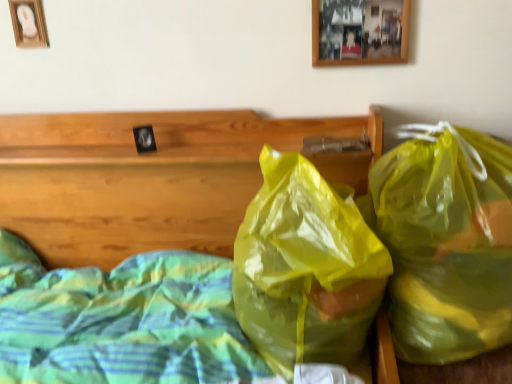
Identify the location of wooden picture frame at upper left, which is counted as the 2th picture frame, starting from the front. (28, 23).

The width and height of the screenshot is (512, 384). Describe the element at coordinates (360, 32) in the screenshot. I see `wooden picture frame at upper center, acting as the 2th picture frame starting from the back` at that location.

Measure the distance between point (487,321) and camera.

Point (487,321) and camera are 34.45 inches apart from each other.

The width and height of the screenshot is (512, 384). Find the location of `wooden picture frame at upper left, which is counted as the 2th picture frame, starting from the front`. wooden picture frame at upper left, which is counted as the 2th picture frame, starting from the front is located at coordinates (28, 23).

Is translucent yellow plastic bag at right, the second plastic bag viewed from the left, bigger than translucent plastic bags at center?

Actually, translucent yellow plastic bag at right, the second plastic bag viewed from the left, might be smaller than translucent plastic bags at center.

Is the depth of translucent yellow plastic bag at right, which is counted as the 1th plastic bag, starting from the right, less than that of translucent plastic bags at center?

No, it is behind translucent plastic bags at center.

From a real-world perspective, is translucent yellow plastic bag at right, which is counted as the 1th plastic bag, starting from the right, positioned above or below translucent plastic bags at center?

Clearly, from a real-world perspective, translucent yellow plastic bag at right, which is counted as the 1th plastic bag, starting from the right, is below translucent plastic bags at center.

Does point (454, 329) come behind point (210, 245)?

No, it is in front of (210, 245).

From a real-world perspective, is translucent plastic bags at center positioned over wooden picture frame at upper left, acting as the 1th picture frame starting from the left, based on gravity?

Incorrect, from a real-world perspective, translucent plastic bags at center is lower than wooden picture frame at upper left, acting as the 1th picture frame starting from the left.

In the scene shown: From the image's perspective, is translucent plastic bags at center below wooden picture frame at upper left, acting as the 1th picture frame starting from the left?

Indeed, from the image's perspective, translucent plastic bags at center is shown beneath wooden picture frame at upper left, acting as the 1th picture frame starting from the left.

Considering the positions of points (213, 187) and (19, 0), is point (213, 187) farther from camera compared to point (19, 0)?

Yes, it is behind point (19, 0).

Measure the distance from translucent plastic bags at center to wooden picture frame at upper left, acting as the 1th picture frame starting from the left.

The distance of translucent plastic bags at center from wooden picture frame at upper left, acting as the 1th picture frame starting from the left, is 20.96 inches.

From the image's perspective, who appears lower, wooden picture frame at upper center, the second picture frame positioned from the left, or translucent plastic bags at center?

translucent plastic bags at center, from the image's perspective.

From the picture: Is wooden picture frame at upper center, the second picture frame positioned from the left, oriented away from translucent plastic bags at center?

wooden picture frame at upper center, the second picture frame positioned from the left, is not turned away from translucent plastic bags at center.

Which is farther from the camera, (386,62) or (257,148)?

Positioned behind is point (257,148).

Visually, is wooden picture frame at upper center, the 1th picture frame positioned from the front, positioned to the left or to the right of translucent plastic bags at center?

wooden picture frame at upper center, the 1th picture frame positioned from the front, is positioned on translucent plastic bags at center's right side.

Considering the sizes of objects translucent yellow plastic bag at center, which is counted as the second plastic bag, starting from the right, and wooden picture frame at upper center, acting as the 2th picture frame starting from the back, in the image provided, who is smaller, translucent yellow plastic bag at center, which is counted as the second plastic bag, starting from the right, or wooden picture frame at upper center, acting as the 2th picture frame starting from the back,?

wooden picture frame at upper center, acting as the 2th picture frame starting from the back, is smaller.

Consider the image. From the image's perspective, is translucent yellow plastic bag at center, which is counted as the second plastic bag, starting from the right, over wooden picture frame at upper center, acting as the 2th picture frame starting from the back?

No, from the image's perspective, translucent yellow plastic bag at center, which is counted as the second plastic bag, starting from the right, is not on top of wooden picture frame at upper center, acting as the 2th picture frame starting from the back.

Which object is more forward, translucent yellow plastic bag at center, marked as the 1th plastic bag in a left-to-right arrangement, or wooden picture frame at upper center, acting as the 2th picture frame starting from the back?

Positioned in front is translucent yellow plastic bag at center, marked as the 1th plastic bag in a left-to-right arrangement.

Looking at this image, how distant is translucent yellow plastic bag at center, marked as the 1th plastic bag in a left-to-right arrangement, from wooden picture frame at upper center, the 1th picture frame positioned from the front?

A distance of 22.49 inches exists between translucent yellow plastic bag at center, marked as the 1th plastic bag in a left-to-right arrangement, and wooden picture frame at upper center, the 1th picture frame positioned from the front.

Consider the image. Is translucent plastic bags at center aimed at translucent yellow plastic bag at right, which is counted as the 1th plastic bag, starting from the right?

No, translucent plastic bags at center is not aimed at translucent yellow plastic bag at right, which is counted as the 1th plastic bag, starting from the right.

Considering the relative sizes of translucent plastic bags at center and translucent yellow plastic bag at right, which is counted as the 1th plastic bag, starting from the right, in the image provided, is translucent plastic bags at center smaller than translucent yellow plastic bag at right, which is counted as the 1th plastic bag, starting from the right,?

No.

How different are the orientations of translucent plastic bags at center and translucent yellow plastic bag at right, the second plastic bag viewed from the left, in degrees?

0.857 degrees separate the facing orientations of translucent plastic bags at center and translucent yellow plastic bag at right, the second plastic bag viewed from the left.

From the image's perspective, which is above, translucent plastic bags at center or translucent yellow plastic bag at right, the second plastic bag viewed from the left?

From the image's view, translucent yellow plastic bag at right, the second plastic bag viewed from the left, is above.

From a real-world perspective, does wooden picture frame at upper center, the 1th picture frame positioned from the front, sit lower than translucent yellow plastic bag at center, which is counted as the second plastic bag, starting from the right?

No, from a real-world perspective, wooden picture frame at upper center, the 1th picture frame positioned from the front, is not beneath translucent yellow plastic bag at center, which is counted as the second plastic bag, starting from the right.

Is wooden picture frame at upper center, acting as the 2th picture frame starting from the back, not close to translucent yellow plastic bag at center, which is counted as the second plastic bag, starting from the right?

They are positioned close to each other.

Is translucent yellow plastic bag at center, which is counted as the second plastic bag, starting from the right, at the back of wooden picture frame at upper center, which ranks as the first picture frame in right-to-left order?

No, wooden picture frame at upper center, which ranks as the first picture frame in right-to-left order,'s orientation is not away from translucent yellow plastic bag at center, which is counted as the second plastic bag, starting from the right.

Between wooden picture frame at upper center, the second picture frame positioned from the left, and translucent yellow plastic bag at center, which is counted as the second plastic bag, starting from the right, which one has larger width?

translucent yellow plastic bag at center, which is counted as the second plastic bag, starting from the right, is wider.

The width and height of the screenshot is (512, 384). I want to click on picture frame located on the left of wooden picture frame at upper center, acting as the 2th picture frame starting from the back, so (28, 23).

Is wooden picture frame at upper center, which ranks as the first picture frame in right-to-left order, directly adjacent to wooden picture frame at upper left, which appears as the 1th picture frame when viewed from the back?

No, wooden picture frame at upper center, which ranks as the first picture frame in right-to-left order, is not making contact with wooden picture frame at upper left, which appears as the 1th picture frame when viewed from the back.

Is wooden picture frame at upper left, which appears as the 1th picture frame when viewed from the back, surrounded by wooden picture frame at upper center, the second picture frame positioned from the left?

That's incorrect, wooden picture frame at upper left, which appears as the 1th picture frame when viewed from the back, is not inside wooden picture frame at upper center, the second picture frame positioned from the left.

From a real-world perspective, which is physically above, wooden picture frame at upper center, acting as the 2th picture frame starting from the back, or wooden picture frame at upper left, acting as the 1th picture frame starting from the left?

wooden picture frame at upper left, acting as the 1th picture frame starting from the left.

Identify the location of bed that appears below the translucent yellow plastic bag at right, the second plastic bag viewed from the left (from the image's perspective). (151, 178).

Locate an element on the screen. picture frame that is the 2nd object located behind the translucent plastic bags at center is located at coordinates (28, 23).

From the image, which object appears to be farther from translucent yellow plastic bag at center, which is counted as the second plastic bag, starting from the right, wooden picture frame at upper left, which appears as the 1th picture frame when viewed from the back, or translucent plastic bags at center?

The object further to translucent yellow plastic bag at center, which is counted as the second plastic bag, starting from the right, is wooden picture frame at upper left, which appears as the 1th picture frame when viewed from the back.

Based on their spatial positions, is translucent yellow plastic bag at center, marked as the 1th plastic bag in a left-to-right arrangement, or translucent yellow plastic bag at right, which is counted as the 1th plastic bag, starting from the right, further from translucent plastic bags at center?

translucent yellow plastic bag at right, which is counted as the 1th plastic bag, starting from the right, is positioned further to the anchor translucent plastic bags at center.

In the scene shown: Estimate the real-world distances between objects in this image. Which object is further from wooden picture frame at upper left, which is the second picture frame in right-to-left order, translucent yellow plastic bag at center, which is counted as the second plastic bag, starting from the right, or translucent yellow plastic bag at right, which is counted as the 1th plastic bag, starting from the right?

translucent yellow plastic bag at right, which is counted as the 1th plastic bag, starting from the right, is further to wooden picture frame at upper left, which is the second picture frame in right-to-left order.

Which object lies nearer to the anchor point translucent yellow plastic bag at right, the second plastic bag viewed from the left, wooden picture frame at upper left, acting as the 1th picture frame starting from the left, or translucent yellow plastic bag at center, which is counted as the second plastic bag, starting from the right?

Based on the image, translucent yellow plastic bag at center, which is counted as the second plastic bag, starting from the right, appears to be nearer to translucent yellow plastic bag at right, the second plastic bag viewed from the left.

Which object lies further to the anchor point translucent yellow plastic bag at center, which is counted as the second plastic bag, starting from the right, wooden picture frame at upper left, acting as the 1th picture frame starting from the left, or translucent yellow plastic bag at right, which is counted as the 1th plastic bag, starting from the right?

Based on the image, wooden picture frame at upper left, acting as the 1th picture frame starting from the left, appears to be further to translucent yellow plastic bag at center, which is counted as the second plastic bag, starting from the right.

Considering their positions, is wooden picture frame at upper left, acting as the 1th picture frame starting from the left, positioned closer to translucent plastic bags at center than translucent yellow plastic bag at center, marked as the 1th plastic bag in a left-to-right arrangement?

The object closer to translucent plastic bags at center is translucent yellow plastic bag at center, marked as the 1th plastic bag in a left-to-right arrangement.

Based on their spatial positions, is translucent yellow plastic bag at center, marked as the 1th plastic bag in a left-to-right arrangement, or translucent plastic bags at center further from wooden picture frame at upper left, which appears as the 1th picture frame when viewed from the back?

translucent yellow plastic bag at center, marked as the 1th plastic bag in a left-to-right arrangement, is positioned further to the anchor wooden picture frame at upper left, which appears as the 1th picture frame when viewed from the back.

Considering their positions, is translucent yellow plastic bag at center, which is counted as the second plastic bag, starting from the right, positioned closer to translucent plastic bags at center than wooden picture frame at upper left, which appears as the 1th picture frame when viewed from the back?

Among the two, translucent yellow plastic bag at center, which is counted as the second plastic bag, starting from the right, is located nearer to translucent plastic bags at center.

What are the coordinates of `bed between wooden picture frame at upper left, which appears as the 1th picture frame when viewed from the back, and translucent yellow plastic bag at right, the second plastic bag viewed from the left, from left to right` in the screenshot? It's located at (151, 178).

Where is `picture frame located between translucent plastic bags at center and wooden picture frame at upper left, which is counted as the 2th picture frame, starting from the front, in the depth direction`? picture frame located between translucent plastic bags at center and wooden picture frame at upper left, which is counted as the 2th picture frame, starting from the front, in the depth direction is located at coordinates (360, 32).

The image size is (512, 384). I want to click on plastic bag situated between translucent plastic bags at center and translucent yellow plastic bag at right, the second plastic bag viewed from the left, from left to right, so click(x=305, y=268).

At what (x,y) coordinates should I click in order to perform the action: click on picture frame between wooden picture frame at upper left, which is the second picture frame in right-to-left order, and translucent yellow plastic bag at right, which is counted as the 1th plastic bag, starting from the right. Please return your answer as a coordinate pair (x, y). Image resolution: width=512 pixels, height=384 pixels. Looking at the image, I should click on (360, 32).